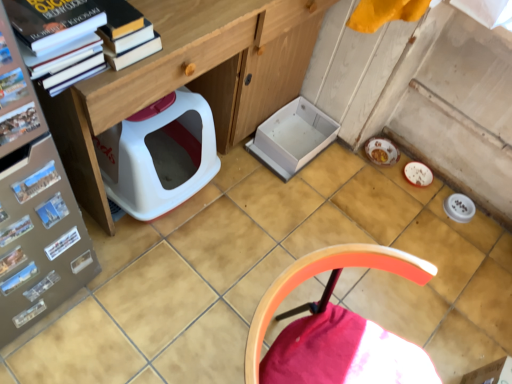
Image resolution: width=512 pixels, height=384 pixels. Find the location of `vacant space to the right of matte wood desk at center`. vacant space to the right of matte wood desk at center is located at coordinates (320, 213).